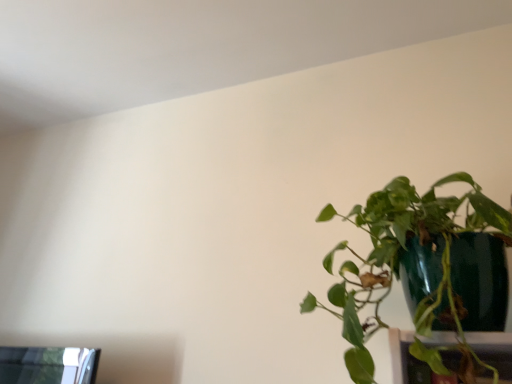
Describe the element at coordinates (399, 259) in the screenshot. Image resolution: width=512 pixels, height=384 pixels. I see `green glossy pot at right` at that location.

The image size is (512, 384). In order to click on green glossy pot at right in this screenshot , I will do `click(399, 259)`.

The image size is (512, 384). I want to click on green glossy pot at right, so click(x=399, y=259).